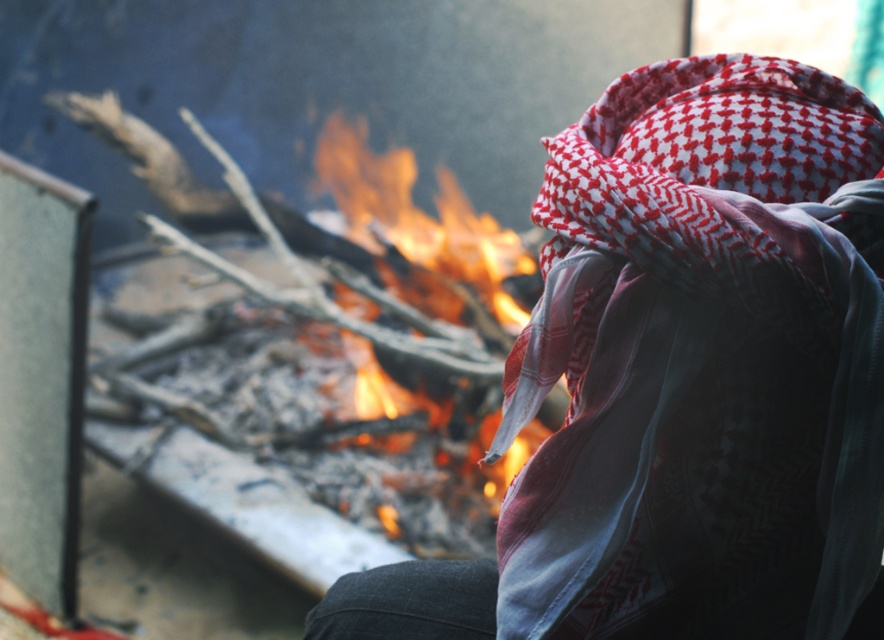
Which is behind, point (555, 320) or point (351, 131)?

Point (351, 131)

Does red-white checkered scarf at right have a larger size compared to flaming wood at center?

Incorrect, red-white checkered scarf at right is not larger than flaming wood at center.

Measure the distance between red-white checkered scarf at right and camera.

red-white checkered scarf at right is 27.21 inches from camera.

Where is `red-white checkered scarf at right`? This screenshot has height=640, width=884. red-white checkered scarf at right is located at coordinates (703, 362).